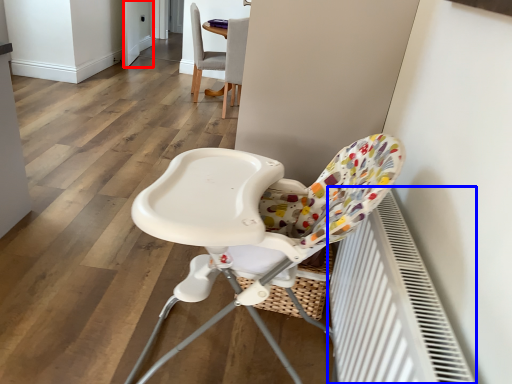
Question: Which of the following is the farthest to the observer, screen door (highlighted by a red box) or radiator (highlighted by a blue box)?

Choices:
 (A) screen door
 (B) radiator

Answer: (A)